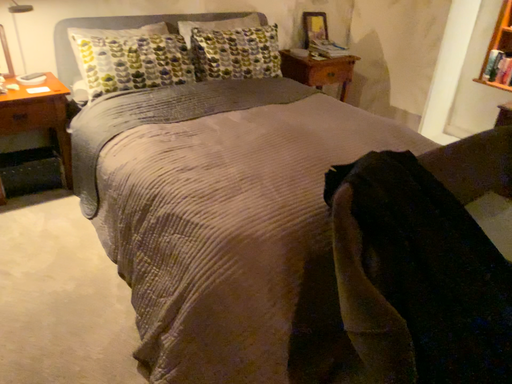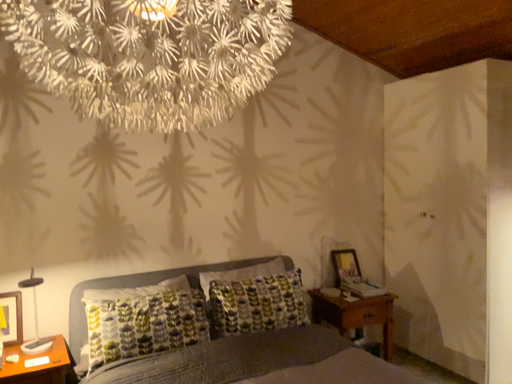
Question: Which way did the camera rotate in the video?

Choices:
 (A) rotated right
 (B) rotated left

Answer: (B)